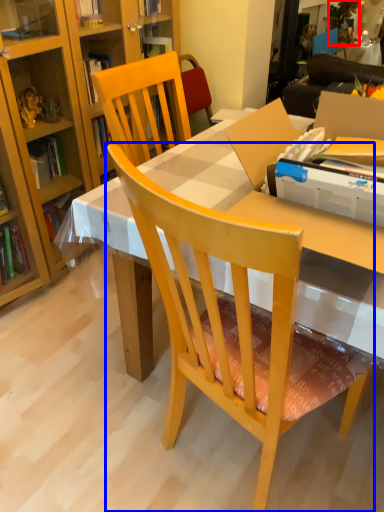
Question: Which point is closer to the camera, houseplant (highlighted by a red box) or chair (highlighted by a blue box)?

Choices:
 (A) houseplant
 (B) chair

Answer: (B)